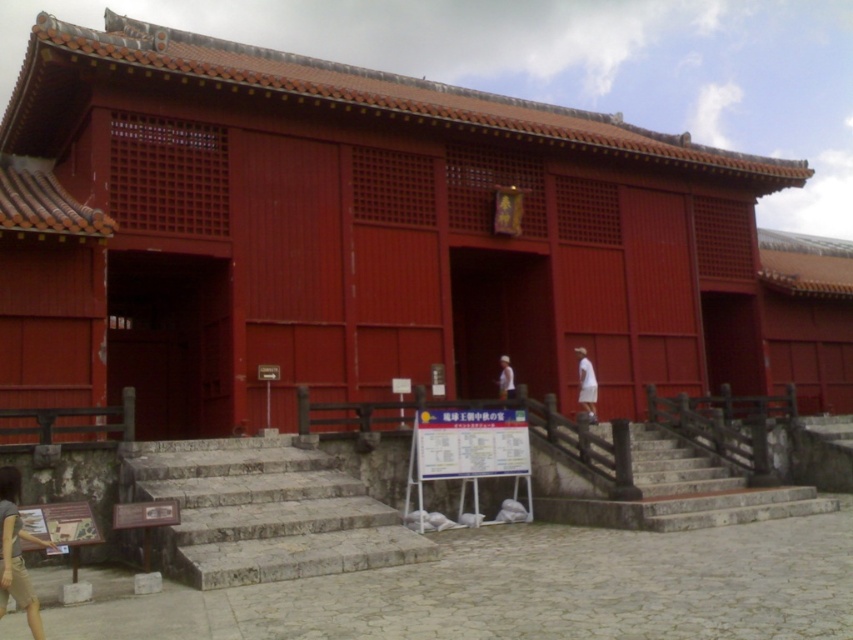
You are a tourist visiting a traditional Japanese temple. You see the matte red wood temple at center and the light brown fabric shorts at lower left. Which object is taller?

The matte red wood temple at center is taller than the light brown fabric shorts at lower left.

You are standing at the entrance of the matte red wood temple at center and want to check your friend who is wearing light brown fabric shorts at lower left. In which direction should you look to see them?

You should look to the left because the matte red wood temple at center is to the right of the light brown fabric shorts at lower left, meaning the light brown fabric shorts at lower left is to your left.